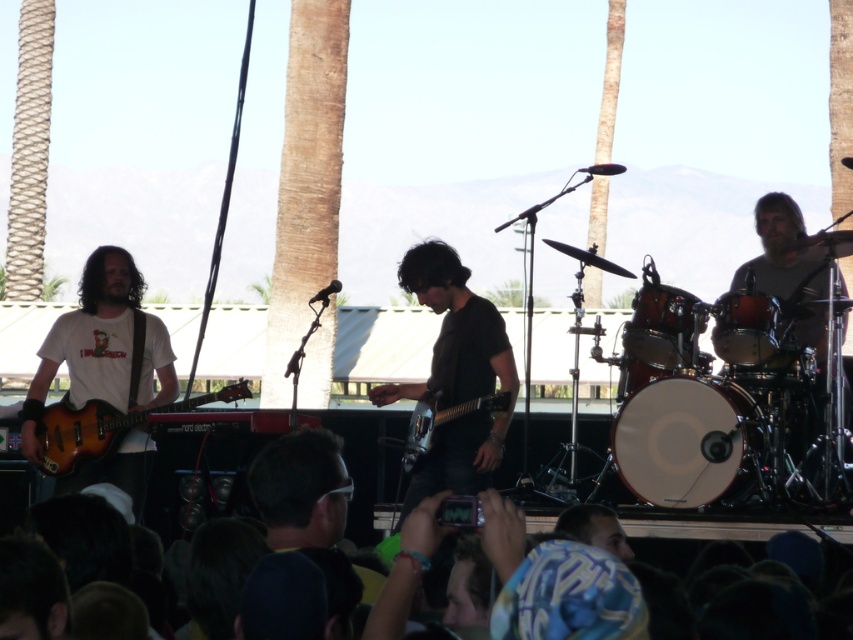
You are a stagehand carrying a 12 inch long microphone stand. You need to place it between the shiny metallic drum at right and the matte black drum at center. Is there enough space?

The distance between the shiny metallic drum at right and the matte black drum at center is 12.38 inches. Since the microphone stand is 12 inches long, there is enough space to place it between them.

You are standing at the front of the stage during a live music performance. You want to place a 2.5 meter long banner between you and the shiny metallic drum at right. Is there enough space to do this?

The distance between you and the shiny metallic drum at right is 6.76 meters. Since the banner is 2.5 meters long, there is sufficient space to place it between you and the drum.

You are a photographer positioned at the front of the stage. You want to take a photo that includes both the matte brown guitar at left and the shiny metallic guitar at center. Which guitar should you adjust your camera angle to focus on first to ensure both are in frame?

The matte brown guitar at left is closer to you than the shiny metallic guitar at center, so you should focus on the shiny metallic guitar at center first to ensure both are in frame.